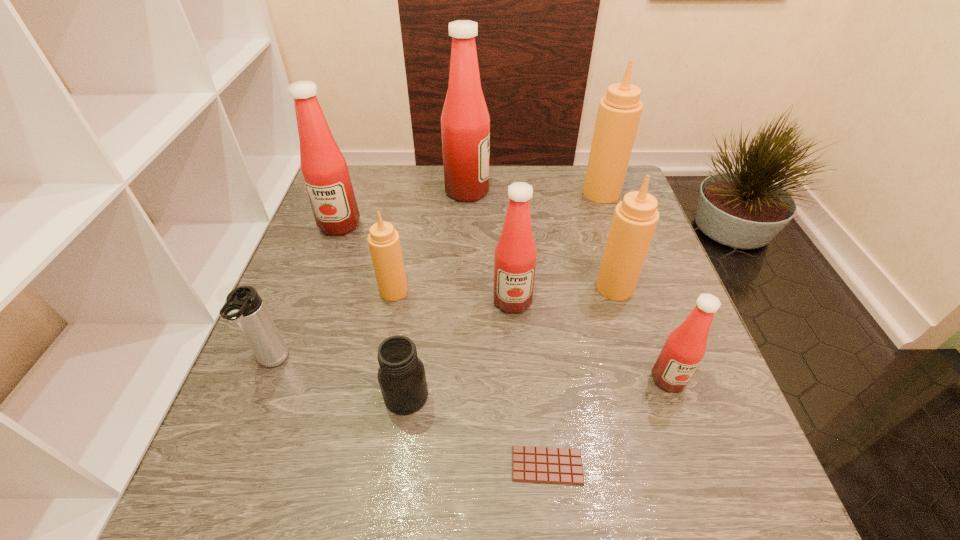
At what (x,y) coordinates should I click in order to perform the action: click on vacant space located 0.360m on the front-facing side of the second red condiment from right to left. Please return your answer as a coordinate pair (x, y). The width and height of the screenshot is (960, 540). Looking at the image, I should click on (525, 486).

Where is `vacant area located on the front of the smallest tan condiment`? vacant area located on the front of the smallest tan condiment is located at coordinates (372, 407).

The image size is (960, 540). What are the coordinates of `free spot located 0.110m on the front-facing side of the smallest red condiment` in the screenshot? It's located at (693, 451).

Where is `vacant space located 0.150m on the handle side of the eighth tallest object`? vacant space located 0.150m on the handle side of the eighth tallest object is located at coordinates (234, 459).

Find the location of `free space located 0.250m on the back of the second shortest object`. free space located 0.250m on the back of the second shortest object is located at coordinates (420, 285).

Locate an element on the screen. Image resolution: width=960 pixels, height=540 pixels. vacant space located on the back of the nearest object is located at coordinates (533, 328).

The width and height of the screenshot is (960, 540). Find the location of `object present at the near edge`. object present at the near edge is located at coordinates (549, 465).

You are a GUI agent. You are given a task and a screenshot of the screen. Output one action in this format:
    pyautogui.click(x=<x>, y=<y>)
    Task: Click on the condiment at the left edge
    The height and width of the screenshot is (540, 960).
    Given the screenshot: What is the action you would take?
    pyautogui.click(x=324, y=169)

The width and height of the screenshot is (960, 540). I want to click on thermos bottle that is at the left edge, so click(244, 306).

At what (x,y) coordinates should I click in order to perform the action: click on object at the far right corner. Please return your answer as a coordinate pair (x, y). Looking at the image, I should click on (619, 111).